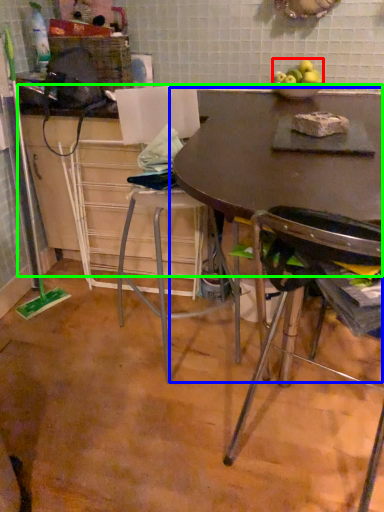
Question: Estimate the real-world distances between objects in this image. Which object is farther from apple (highlighted by a red box), table (highlighted by a blue box) or counter top (highlighted by a green box)?

Choices:
 (A) table
 (B) counter top

Answer: (A)